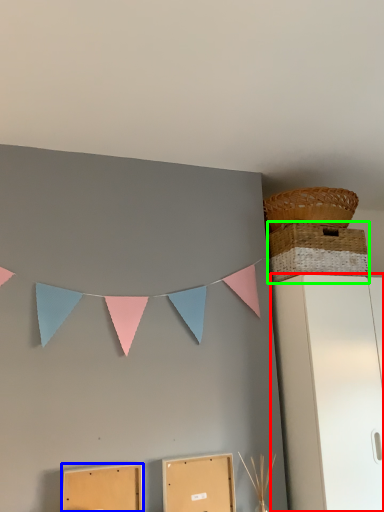
Question: Which object is the farthest from furniture (highlighted by a red box)? Choose among these: cardboard box (highlighted by a blue box) or basket (highlighted by a green box).

Choices:
 (A) cardboard box
 (B) basket

Answer: (A)